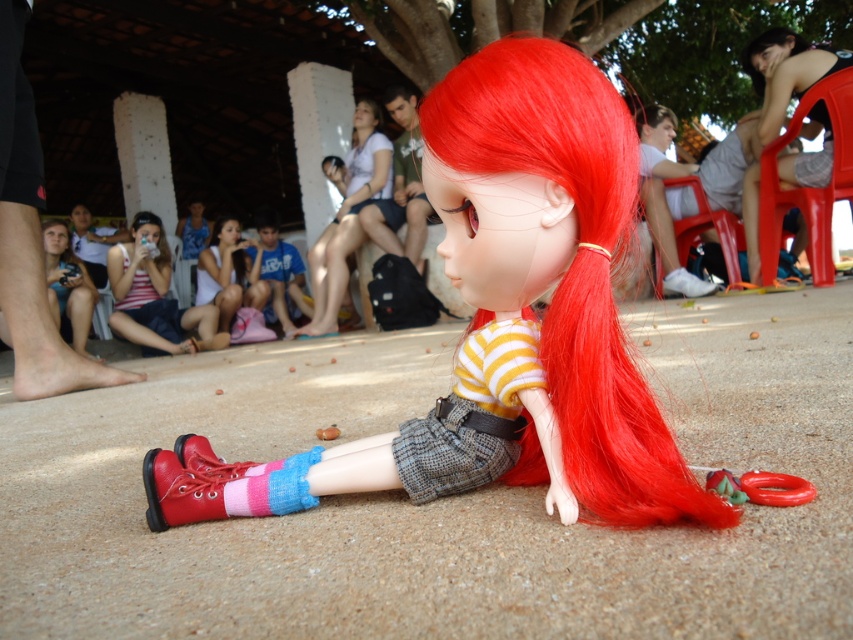
You are organizing a childrens party and need to decide which item to place in a game basket. The striped cotton sock at lower left and the rubberized plastic ring at lower center are both candidates. Which item has a larger diameter?

The striped cotton sock at lower left might be wider than the rubberized plastic ring at lower center according to the description.

From the picture: Where is the striped cotton shirt at center located in the image?

The striped cotton shirt at center is located at point (154, 296) in the image.